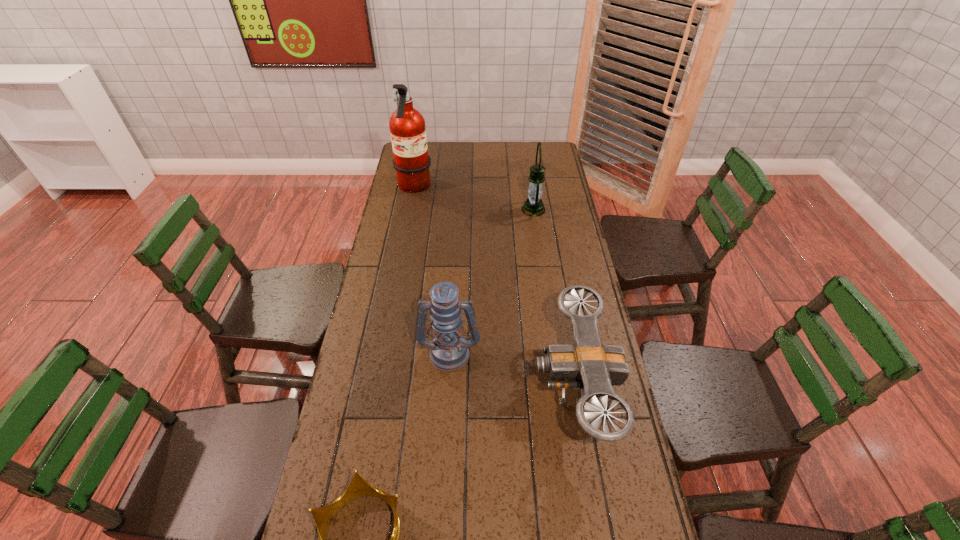
Find the location of a particular element. This screenshot has height=540, width=960. free area in between the left lantern and the fire extinguisher is located at coordinates (432, 270).

You are a GUI agent. You are given a task and a screenshot of the screen. Output one action in this format:
    pyautogui.click(x=<x>, y=<y>)
    Task: Click on the free space between the farther lantern and the fourth tallest object
    The image size is (960, 540).
    Given the screenshot: What is the action you would take?
    pyautogui.click(x=554, y=298)

At what (x,y) coordinates should I click in order to perform the action: click on free point between the fire extinguisher and the fourth tallest object. Please return your answer as a coordinate pair (x, y). This screenshot has height=540, width=960. Looking at the image, I should click on (494, 287).

Locate an element on the screen. The height and width of the screenshot is (540, 960). free point between the fourth tallest object and the fire extinguisher is located at coordinates (494, 287).

Identify which object is located as the nearest to the nearest object. Please provide its 2D coordinates. Your answer should be formatted as a tuple, i.e. [(x, y)], where the tuple contains the x and y coordinates of a point satisfying the conditions above.

[(449, 351)]

Identify which object is the closest to the shortest object. Please provide its 2D coordinates. Your answer should be formatted as a tuple, i.e. [(x, y)], where the tuple contains the x and y coordinates of a point satisfying the conditions above.

[(449, 351)]

At what (x,y) coordinates should I click in order to perform the action: click on free region that satisfies the following two spatial constraints: 1. on the side where the right lantern emits light; 2. on the front-facing side of the left lantern. Please return your answer as a coordinate pair (x, y). Looking at the image, I should click on (554, 352).